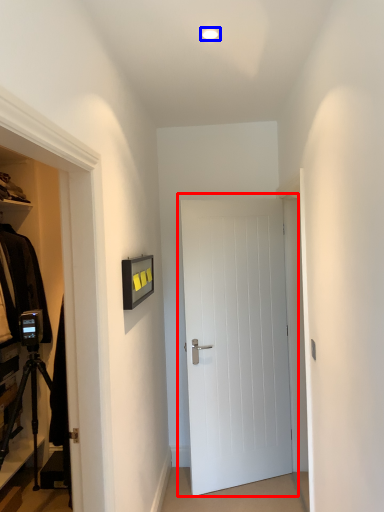
Question: Which point is closer to the camera, door (highlighted by a red box) or lighting (highlighted by a blue box)?

Choices:
 (A) door
 (B) lighting

Answer: (B)